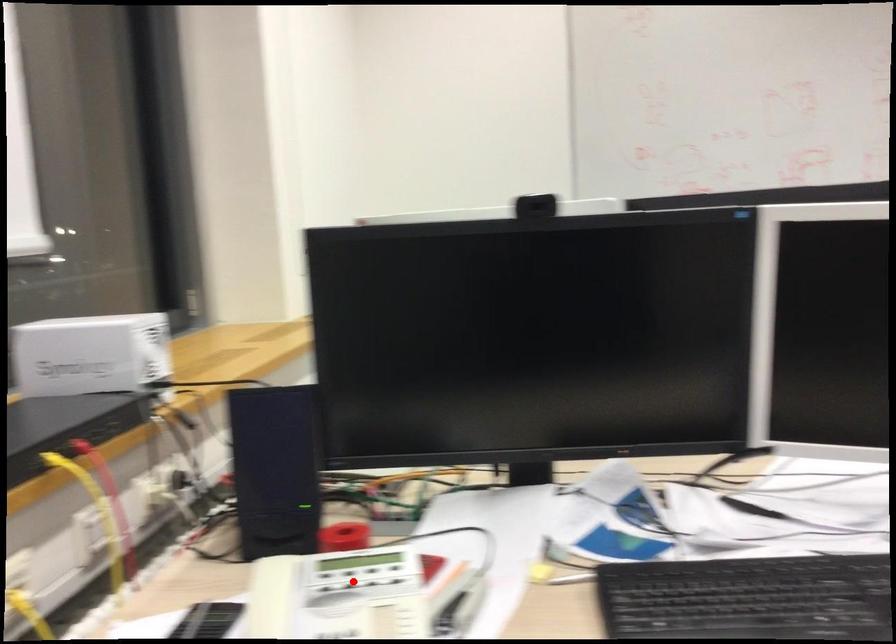
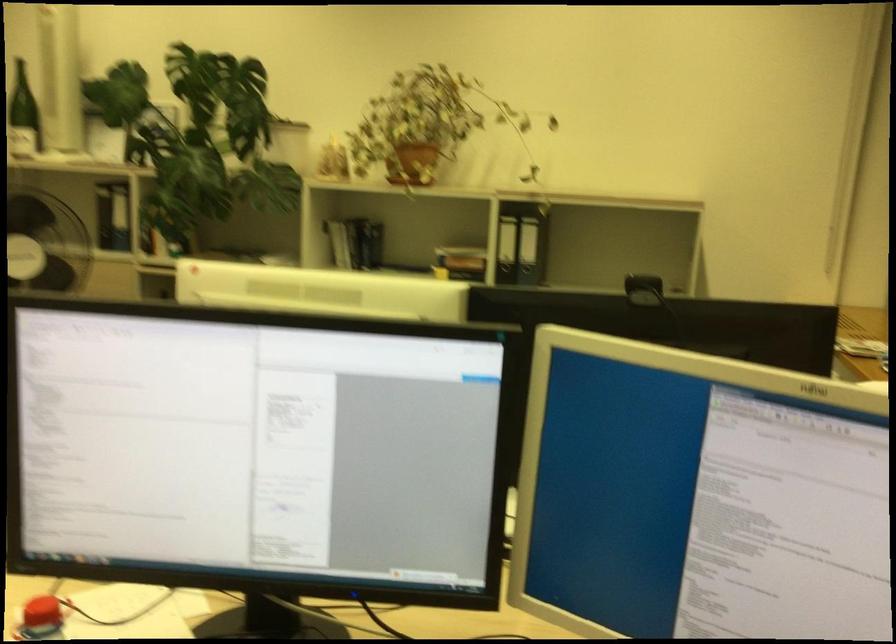
Question: I am providing you with two images of the same scene from different viewpoints. A red point is marked on the first image. At the location where the point appears in image 1, is it still visible in image 2?

Choices:
 (A) Yes
 (B) No

Answer: (B)